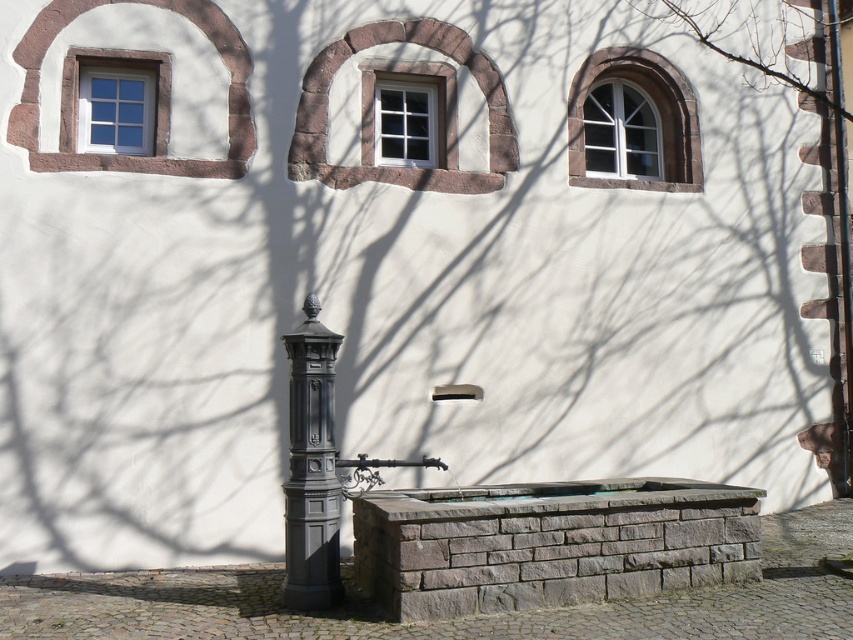
Question: Which point is farther from the camera taking this photo?

Choices:
 (A) (384, 81)
 (B) (316, 456)
 (C) (585, 72)
 (D) (631, 108)

Answer: (D)

Question: Is matte white window at upper right further to the viewer compared to matte white window at upper left?

Choices:
 (A) yes
 (B) no

Answer: (A)

Question: Which of the following is the closest to the observer?

Choices:
 (A) white glass window at upper right
 (B) matte white window at upper right

Answer: (B)

Question: Can you confirm if matte white window at upper right is positioned below matte white window at upper left?

Choices:
 (A) yes
 (B) no

Answer: (A)

Question: Which of these objects is positioned closest to the white glass window at upper right?

Choices:
 (A) matte white window at upper left
 (B) white glass window at center
 (C) matte black post at center
 (D) matte white window at upper right

Answer: (D)

Question: Can you confirm if matte black post at center is bigger than white glass window at upper right?

Choices:
 (A) no
 (B) yes

Answer: (B)